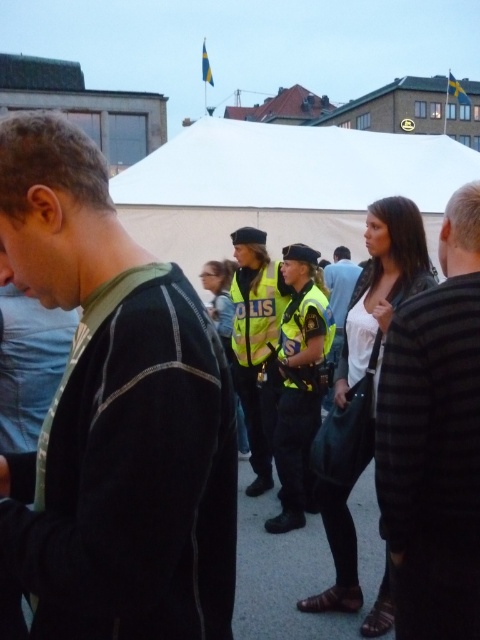
Question: Is black matte jacket at left wider than yellow reflective vest at center?

Choices:
 (A) no
 (B) yes

Answer: (B)

Question: Does striped fabric jacket at center appear on the left side of white shirt at center?

Choices:
 (A) yes
 (B) no

Answer: (A)

Question: Estimate the real-world distances between objects in this image. Which object is farther from the striped fabric jacket at center?

Choices:
 (A) black matte jacket at left
 (B) reflective yellow vest at center

Answer: (B)

Question: Among these points, which one is nearest to the camera?

Choices:
 (A) (468, 429)
 (B) (335, 314)
 (C) (222, 545)
 (D) (235, 314)

Answer: (C)

Question: Does striped fabric jacket at center appear on the left side of reflective yellow vest at center?

Choices:
 (A) no
 (B) yes

Answer: (A)

Question: Among these points, which one is nearest to the camera?

Choices:
 (A) (441, 557)
 (B) (298, 292)
 (C) (194, 561)
 (D) (271, 467)

Answer: (C)